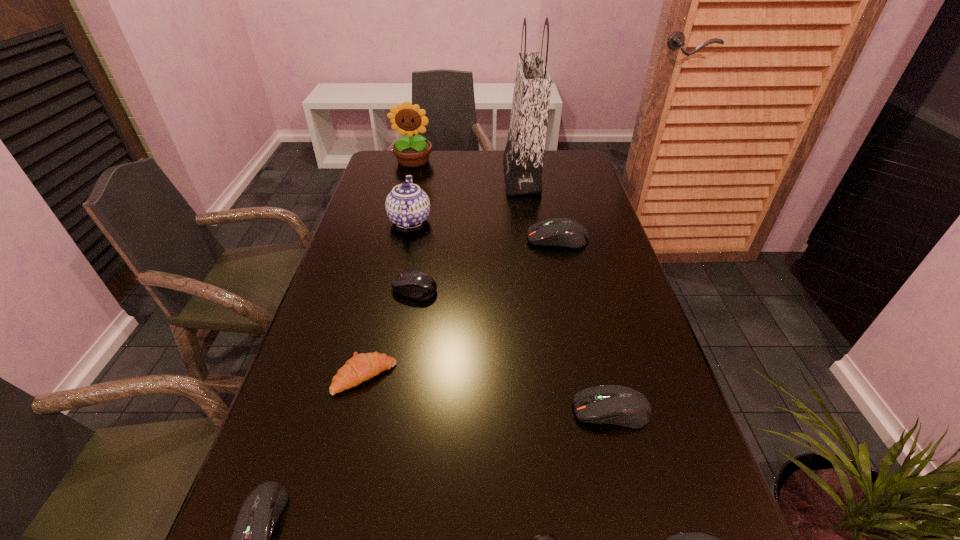
Where is `the fourth nearest computer equipment`? The height and width of the screenshot is (540, 960). the fourth nearest computer equipment is located at coordinates (x=620, y=405).

Where is `crescent roll`? This screenshot has height=540, width=960. crescent roll is located at coordinates (361, 367).

You are a GUI agent. You are given a task and a screenshot of the screen. Output one action in this format:
    pyautogui.click(x=<x>, y=<y>)
    Task: Click on the vacant area situated on the front of the shopping bag with the design
    
    Given the screenshot: What is the action you would take?
    pyautogui.click(x=423, y=175)

At what (x,y) coordinates should I click in order to perform the action: click on vacant space located 0.400m on the front of the shopping bag with the design. Please return your answer as a coordinate pair (x, y). Looking at the image, I should click on (393, 175).

The width and height of the screenshot is (960, 540). I want to click on free space located on the front of the shopping bag with the design, so click(445, 175).

Locate an element on the screen. This screenshot has height=540, width=960. vacant region located on the face of the yellow sunflower is located at coordinates (400, 212).

You are a GUI agent. You are given a task and a screenshot of the screen. Output one action in this format:
    pyautogui.click(x=<x>, y=<y>)
    Task: Click on the blank area located at the spout of the chinaware
    Image resolution: width=960 pixels, height=540 pixels.
    Given the screenshot: What is the action you would take?
    pyautogui.click(x=490, y=221)

This screenshot has width=960, height=540. In order to click on free space located on the button of the farthest computer equipment in this screenshot , I will do `click(499, 239)`.

This screenshot has width=960, height=540. What are the coordinates of `vacant point located 0.300m on the button of the farthest computer equipment` in the screenshot? It's located at (424, 239).

In order to click on free region located on the button of the farthest computer equipment in this screenshot , I will do `click(475, 239)`.